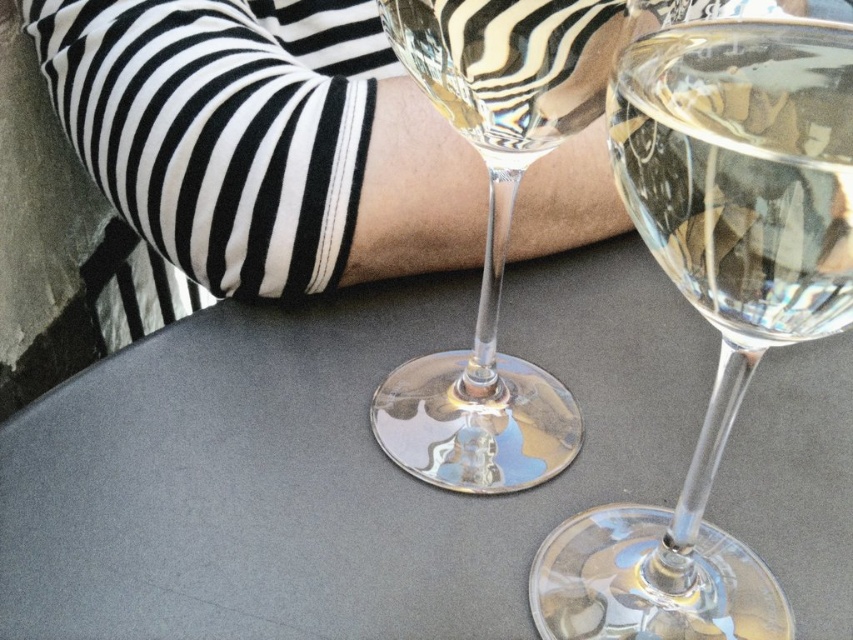
Is point (561, 200) closer to camera compared to point (467, 396)?

No, (561, 200) is further to viewer.

Between striped fabric arm at upper center and clear glass wine glass at center, which one has more height?

Standing taller between the two is striped fabric arm at upper center.

Who is more forward, (97,54) or (461,470)?

Point (461,470)

Locate an element on the screen. striped fabric arm at upper center is located at coordinates (260, 140).

Is striped fabric arm at upper center taller than clear glass wine at center?

Indeed, striped fabric arm at upper center has a greater height compared to clear glass wine at center.

Who is positioned more to the left, striped fabric arm at upper center or clear glass wine at center?

From the viewer's perspective, striped fabric arm at upper center appears more on the left side.

Is point (100, 36) positioned behind point (740, 291)?

Yes, point (100, 36) is farther from viewer.

Image resolution: width=853 pixels, height=640 pixels. What are the coordinates of `striped fabric arm at upper center` in the screenshot? It's located at (260, 140).

Who is positioned more to the left, transparent glass wine glass at center or clear glass wine at center?

From the viewer's perspective, transparent glass wine glass at center appears more on the left side.

Can you confirm if transparent glass wine glass at center is bigger than clear glass wine at center?

Correct, transparent glass wine glass at center is larger in size than clear glass wine at center.

Between point (579, 634) and point (749, 244), which one is positioned in front?

Point (749, 244)

Identify the location of transparent glass wine glass at center. This screenshot has height=640, width=853. (715, 301).